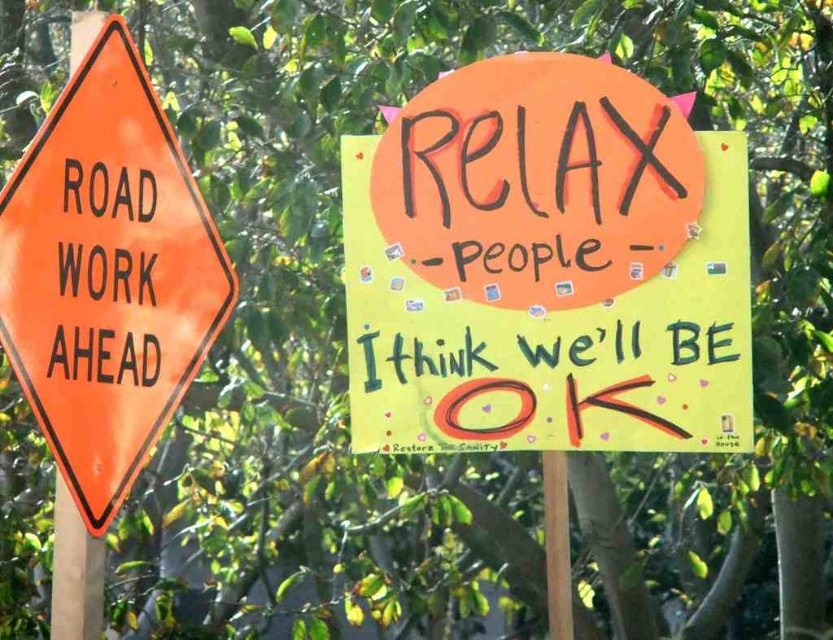
Between green painted text at center and orange plastic signpost at left, which one appears on the left side from the viewer's perspective?

orange plastic signpost at left is more to the left.

Is point (459, 371) positioned in front of point (80, 35)?

No, (459, 371) is further to viewer.

At what (x,y) coordinates should I click in order to perform the action: click on green painted text at center. Please return your answer as a coordinate pair (x, y). Looking at the image, I should click on (542, 349).

Can you confirm if yellow paper poster at upper right is positioned to the right of green painted text at center?

Incorrect, yellow paper poster at upper right is not on the right side of green painted text at center.

Is yellow paper poster at upper right wider than green painted text at center?

Correct, the width of yellow paper poster at upper right exceeds that of green painted text at center.

Where is `yellow paper poster at upper right`? This screenshot has height=640, width=833. yellow paper poster at upper right is located at coordinates (546, 268).

Can you confirm if orange reflective road sign at left is thinner than orange plastic signpost at left?

No, orange reflective road sign at left is not thinner than orange plastic signpost at left.

Does orange reflective road sign at left have a smaller size compared to orange plastic signpost at left?

No.

Locate an element on the screen. orange reflective road sign at left is located at coordinates (106, 269).

You are a GUI agent. You are given a task and a screenshot of the screen. Output one action in this format:
    pyautogui.click(x=<x>, y=<y>)
    Task: Click on the orange reflective road sign at left
    
    Given the screenshot: What is the action you would take?
    pyautogui.click(x=106, y=269)